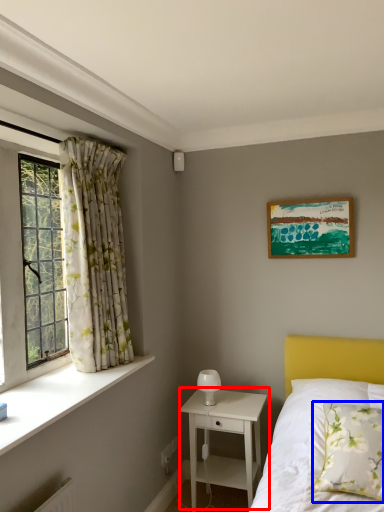
Question: Which object appears farthest to the camera in this image, nightstand (highlighted by a red box) or pillow (highlighted by a blue box)?

Choices:
 (A) nightstand
 (B) pillow

Answer: (A)